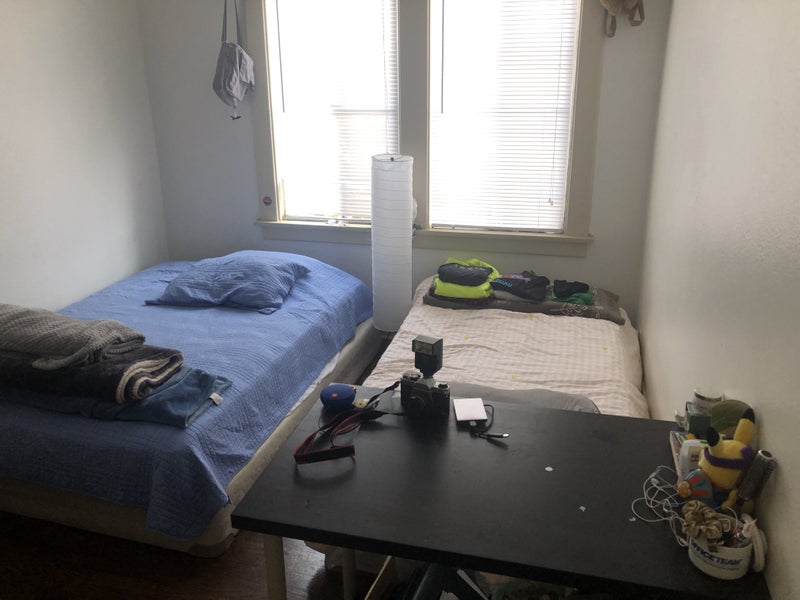
The height and width of the screenshot is (600, 800). I want to click on walls, so click(696, 221), click(634, 138), click(113, 119).